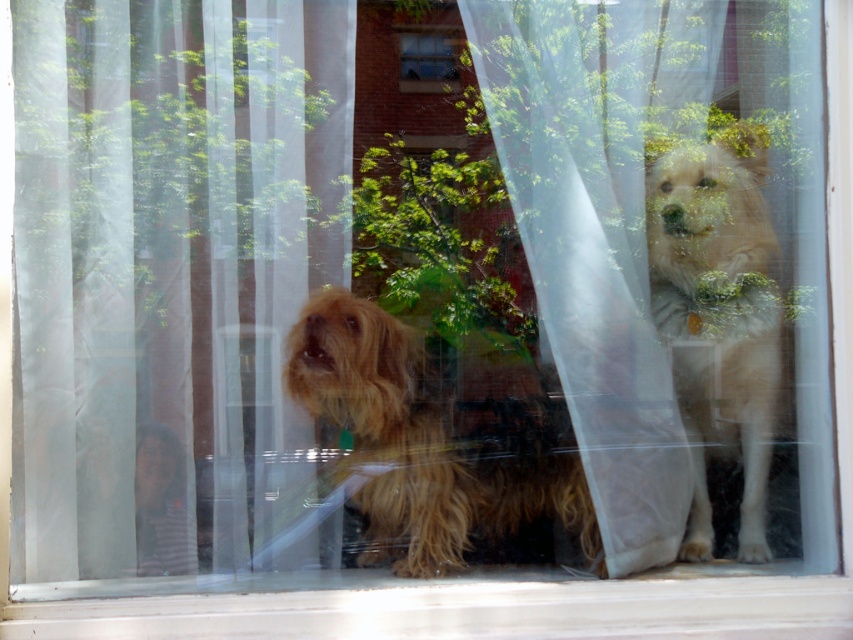
You are standing in front of a window with sheer white curtains. You notice a point marked at coordinates (172, 272). What does this point indicate?

The point at (172, 272) marks the translucent white curtain at left.

You are a delivery person trying to determine the best path to avoid the fuzzy brown dog at center while approaching the clear glass window at center. Based on the scene, which side of the window should you approach from to avoid the dog?

The fuzzy brown dog at center is on the right side of the clear glass window at center, so approaching from the left side of the window would allow you to avoid the dog.

In the scene shown: You are an interior designer trying to place a large painting that is 1.2 meters wide on the wall where the translucent white curtain at left and clear glass window at center are located. Based on their widths, can the painting fit between the two objects without overlapping them?

The translucent white curtain at left is wider than the clear glass window at center. Since the painting is 1.2 meters wide, it depends on the available space between them. However, without specific measurements of the gap between the curtain and the window, we cannot definitively determine if the painting will fit.